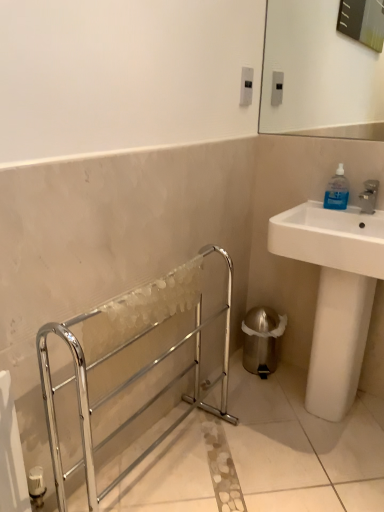
Question: Is chrome metallic towel rack at left situated inside blue translucent bottle at upper right or outside?

Choices:
 (A) inside
 (B) outside

Answer: (B)

Question: Visually, is chrome metallic towel rack at left positioned to the left or to the right of blue translucent bottle at upper right?

Choices:
 (A) right
 (B) left

Answer: (B)

Question: Considering the real-world distances, which object is farthest from the blue translucent bottle at upper right?

Choices:
 (A) white glossy sink at right
 (B) chrome metallic towel rack at left

Answer: (B)

Question: Which of these objects is positioned farthest from the chrome metallic towel rack at left?

Choices:
 (A) white glossy sink at right
 (B) blue translucent bottle at upper right

Answer: (B)